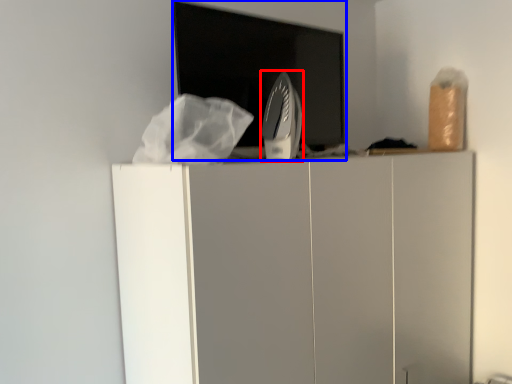
Question: Among these objects, which one is nearest to the camera, home appliance (highlighted by a red box) or appliance (highlighted by a blue box)?

Choices:
 (A) home appliance
 (B) appliance

Answer: (B)